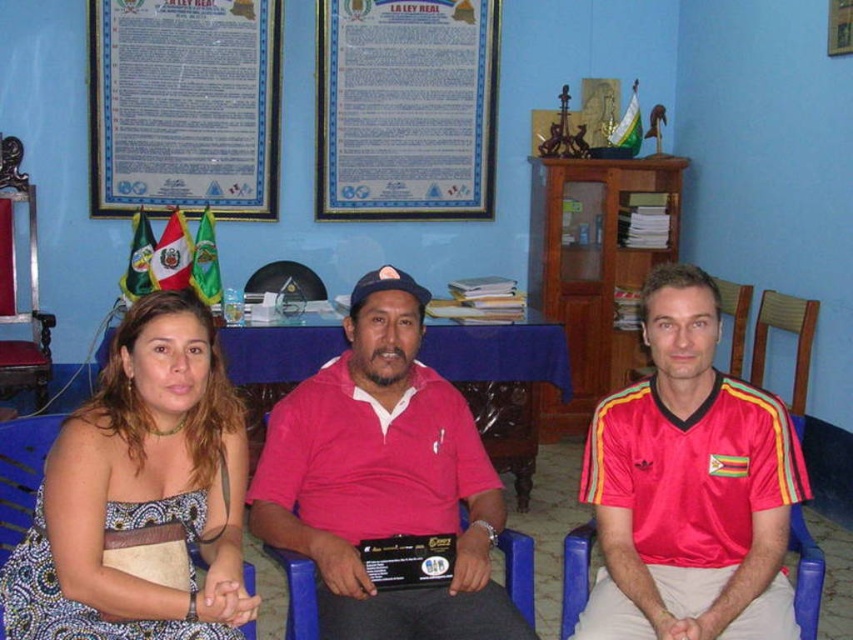
Question: Which object appears farthest from the camera in this image?

Choices:
 (A) paperboard poster at upper center
 (B) printed fabric dress at center
 (C) wooden polished chair at left
 (D) blue plastic chair at center

Answer: (A)

Question: Which point is closer to the camera?

Choices:
 (A) red shiny jersey at center
 (B) pink cotton shirt at center
 (C) paperboard poster at upper center
 (D) printed fabric dress at center

Answer: (D)

Question: Among these objects, which one is farthest from the camera?

Choices:
 (A) wooden polished chair at left
 (B) paperboard poster at upper center
 (C) blue plastic chair at center

Answer: (B)

Question: Does printed fabric dress at center have a greater width compared to blue plastic chair at center?

Choices:
 (A) no
 (B) yes

Answer: (A)

Question: Does pink cotton shirt at center appear under blue plastic chair at center?

Choices:
 (A) no
 (B) yes

Answer: (A)

Question: Can you confirm if red shiny jersey at center is positioned above pink cotton shirt at center?

Choices:
 (A) yes
 (B) no

Answer: (A)